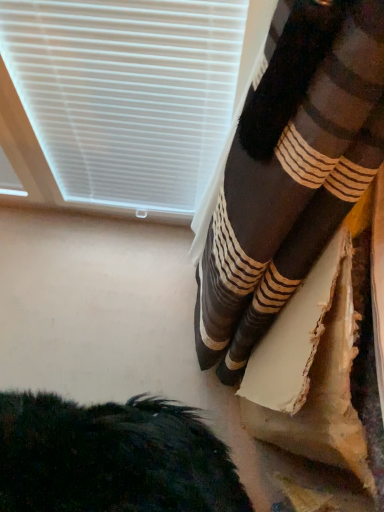
This screenshot has height=512, width=384. In order to click on white plastic blinds at upper left in this screenshot , I will do point(127,93).

The width and height of the screenshot is (384, 512). Describe the element at coordinates (127, 93) in the screenshot. I see `white plastic blinds at upper left` at that location.

Measure the distance between white plastic blinds at upper left and camera.

white plastic blinds at upper left is 25.50 inches from camera.

Image resolution: width=384 pixels, height=512 pixels. Identify the location of white plastic blinds at upper left. (127, 93).